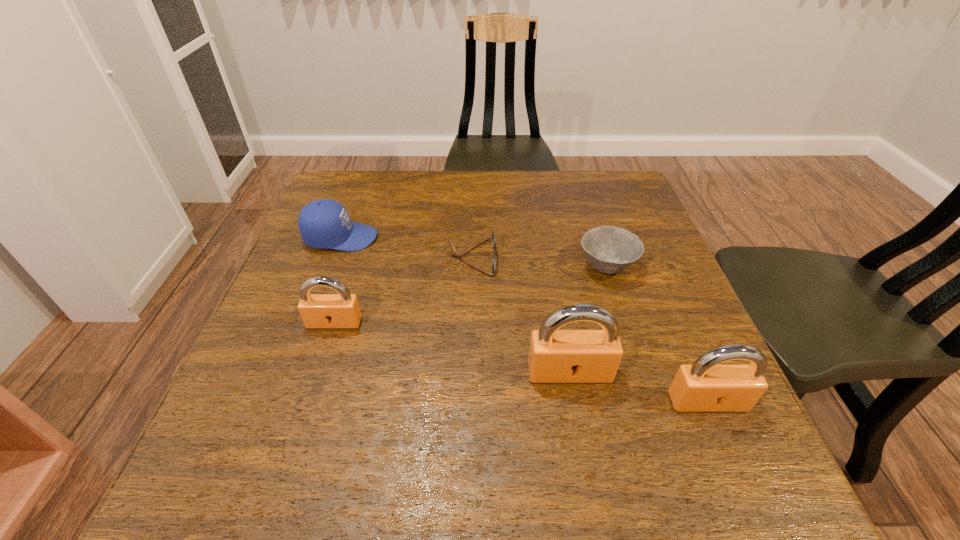
I want to click on the fourth shortest object, so click(341, 310).

Where is `the leftmost padlock`? The image size is (960, 540). the leftmost padlock is located at coordinates (341, 310).

Find the location of a particular element. the second nearest object is located at coordinates (555, 356).

Locate an element on the screen. the second farthest padlock is located at coordinates (555, 356).

At what (x,y) coordinates should I click in order to perform the action: click on the nearest object. Please return your answer as a coordinate pair (x, y). The image size is (960, 540). Looking at the image, I should click on (706, 385).

You are a GUI agent. You are given a task and a screenshot of the screen. Output one action in this format:
    pyautogui.click(x=<x>, y=<y>)
    Task: Click on the rightmost padlock
    The width and height of the screenshot is (960, 540).
    Given the screenshot: What is the action you would take?
    pyautogui.click(x=706, y=385)

Identify the location of cap. (323, 224).

The width and height of the screenshot is (960, 540). I want to click on the shortest object, so click(x=494, y=262).

This screenshot has height=540, width=960. What are the coordinates of `the third object from left to right` in the screenshot? It's located at (494, 262).

The height and width of the screenshot is (540, 960). I want to click on bowl, so click(609, 249).